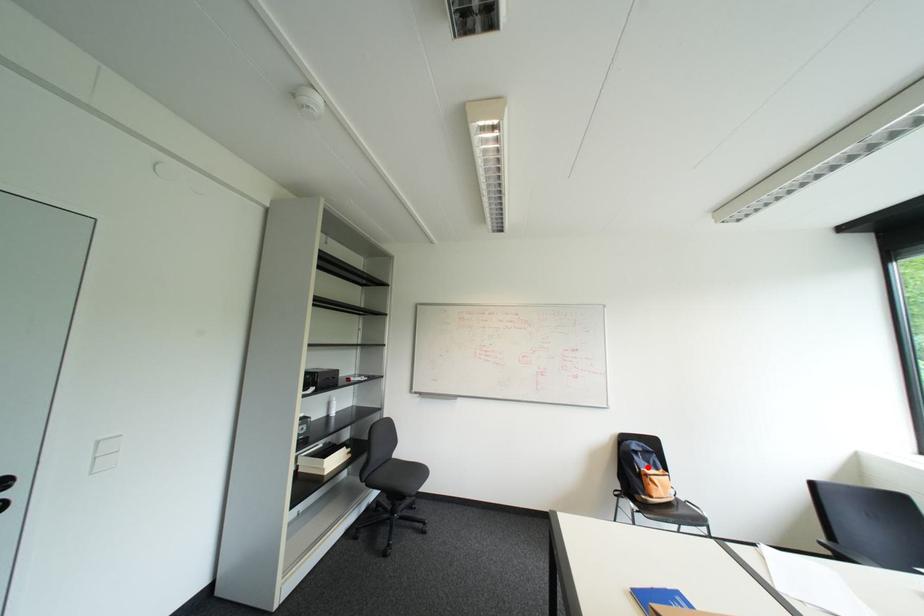
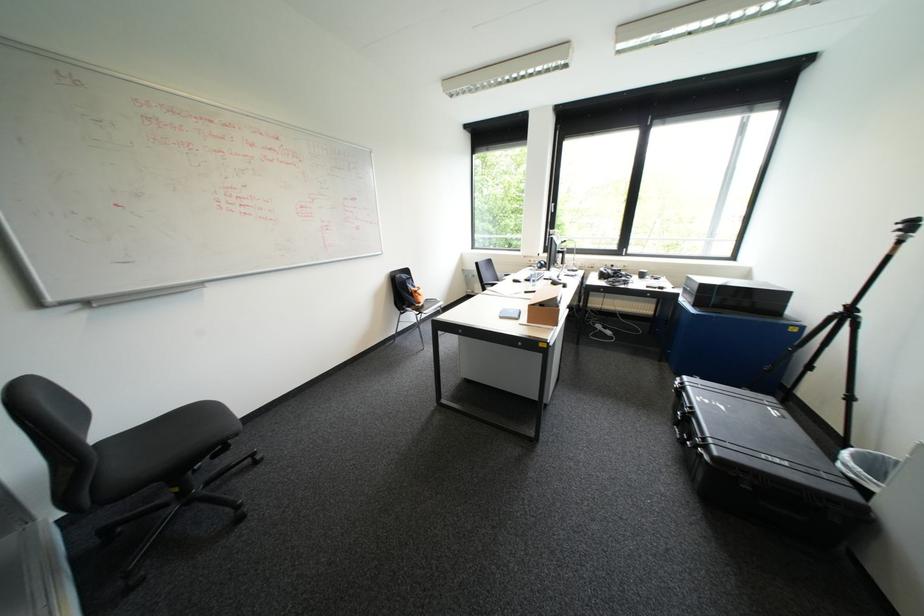
Question: I am providing you with two images of the same scene from different viewpoints. Image1 has a red point marked. In image2, the corresponding 3D location appears at what relative position? Reply with the corresponding letter.

Choices:
 (A) Closer
 (B) Farther

Answer: (A)